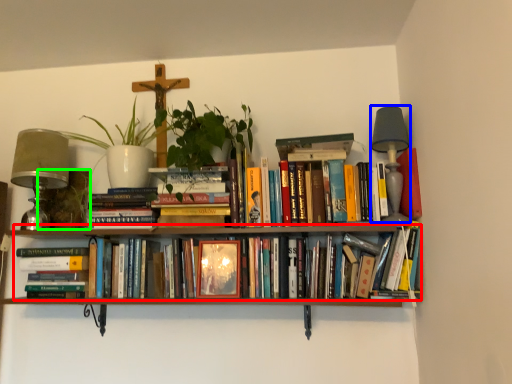
Question: Which is farther away from book (highlighted by a red box)? table lamp (highlighted by a blue box) or plant (highlighted by a green box)?

Choices:
 (A) table lamp
 (B) plant

Answer: (A)